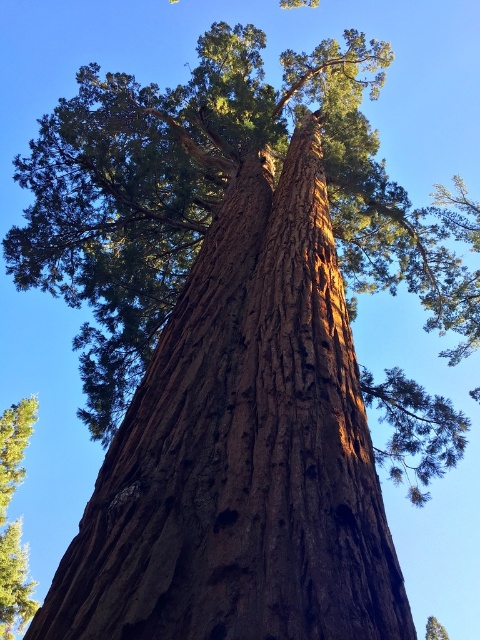
Question: Can you confirm if smooth brown bark at center is positioned above green textured tree at upper center?

Choices:
 (A) no
 (B) yes

Answer: (B)

Question: In this image, where is smooth brown bark at center located relative to green textured tree at upper center?

Choices:
 (A) above
 (B) below

Answer: (A)

Question: Can you confirm if smooth brown bark at center is wider than green textured tree at upper center?

Choices:
 (A) no
 (B) yes

Answer: (A)

Question: Which of the following is the farthest from the observer?

Choices:
 (A) (431, 637)
 (B) (1, 589)

Answer: (A)